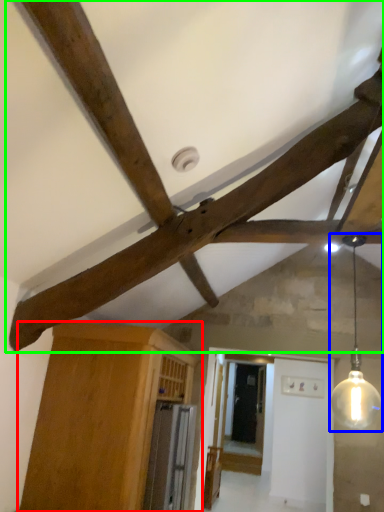
Question: Which object is positioned closest to cabinetry (highlighted by a red box)? Select from light fixture (highlighted by a blue box) and fan (highlighted by a green box).

Choices:
 (A) light fixture
 (B) fan

Answer: (B)